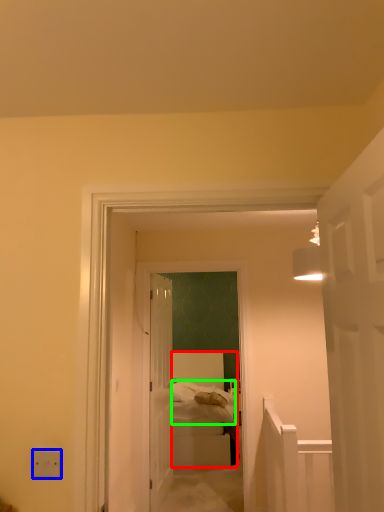
Question: Which object is positioned closest to bed (highlighted by a red box)? Select from electric outlet (highlighted by a blue box) and bedding (highlighted by a green box).

Choices:
 (A) electric outlet
 (B) bedding

Answer: (B)